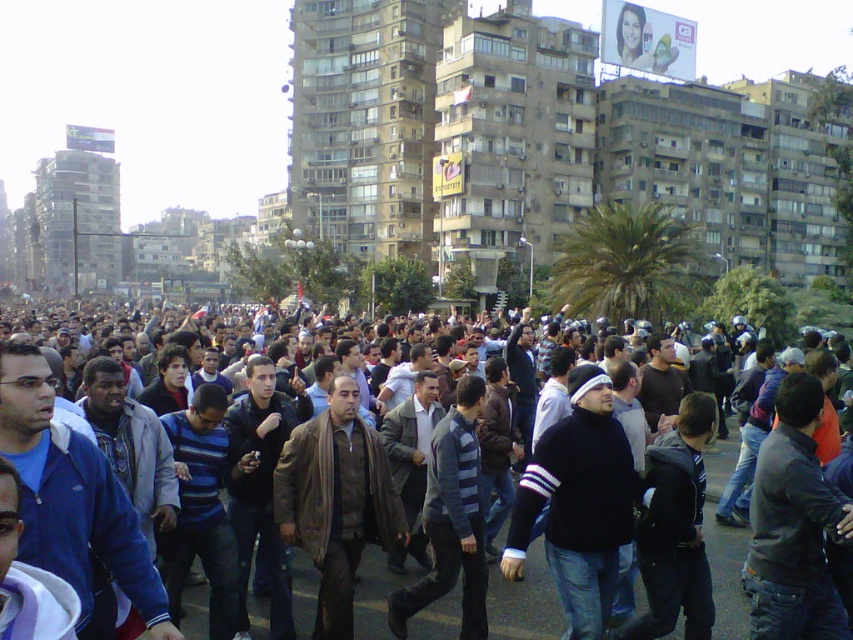
Based on the photo, you are a photographer trying to capture a candid shot of the crowd. You notice two individuals wearing a black matte sweater at center and a brown leather jacket at center. Which clothing item is located to the right of the other?

The black matte sweater at center is positioned on the right side of brown leather jacket at center, so it is located to the right of the brown leather jacket at center.

Consider the image. You are a photographer standing in the middle of the crowd in the urban scene. You want to take a photo that includes both the point at coordinates point (390, 588) and the point at coordinates point (337, 474). Which point should you focus on first to ensure both are in focus?

You should focus on point (337, 474) first because it is closer to you than point (390, 588), which is further away. By focusing on the closer point, the depth of field may help keep both points in focus.

You are a photographer trying to capture a closeup of the dark brown leather jacket at center. The camera you are using has a focal length of 200mm. Based on the coordinates provided, can you determine if the jacket is within the frame of your camera?

The dark brown leather jacket at center is located at coordinates point (724,547), which falls within the camera frame when using a 200mm focal length. Therefore, the jacket is within the frame.